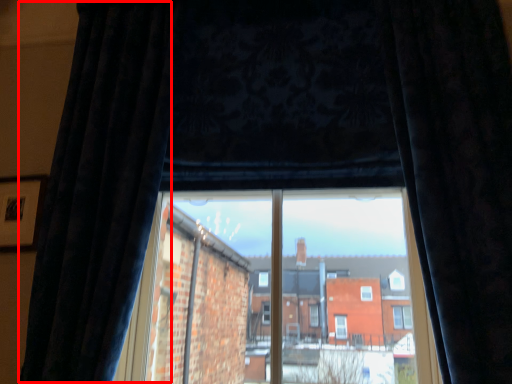
Question: From the image's perspective, what is the correct spatial relationship of curtain (annotated by the red box) in relation to curtain?

Choices:
 (A) below
 (B) above

Answer: (A)